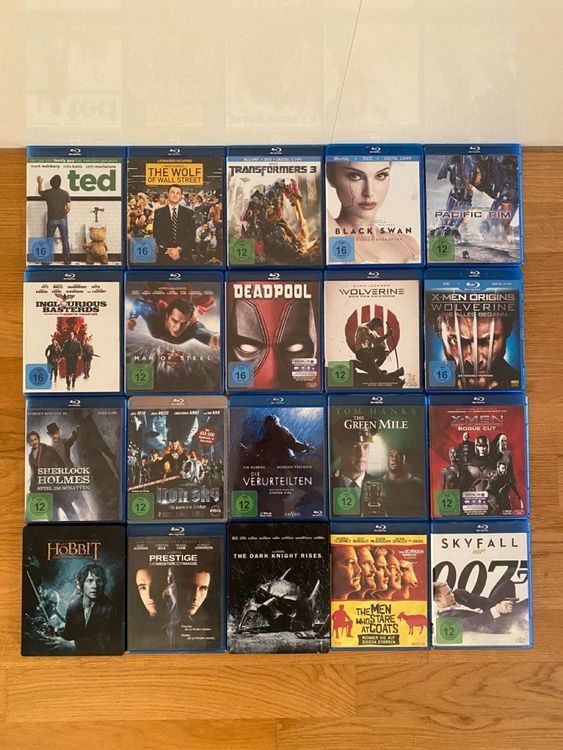
The image size is (563, 750). What are the coordinates of `bottom row of dvds` in the screenshot? It's located at (72, 588), (177, 589), (257, 594), (378, 595), (463, 600).